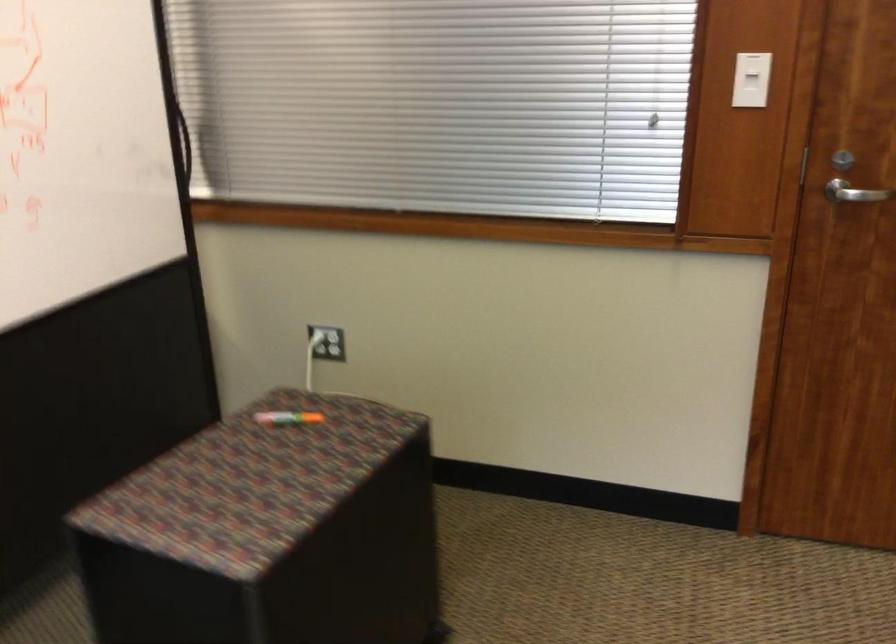
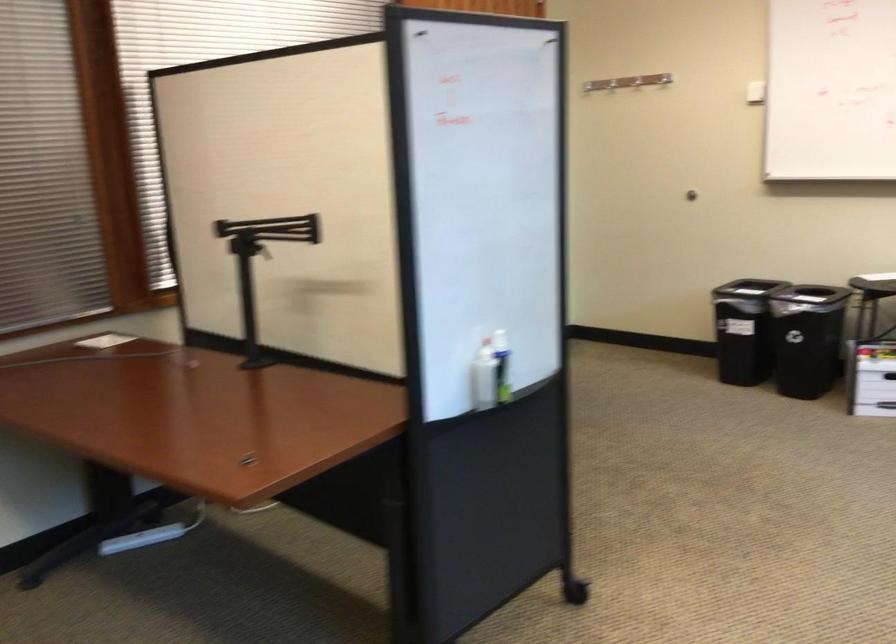
Locate, in the second image, the point that corresponds to (126,180) in the first image.

(261, 263)